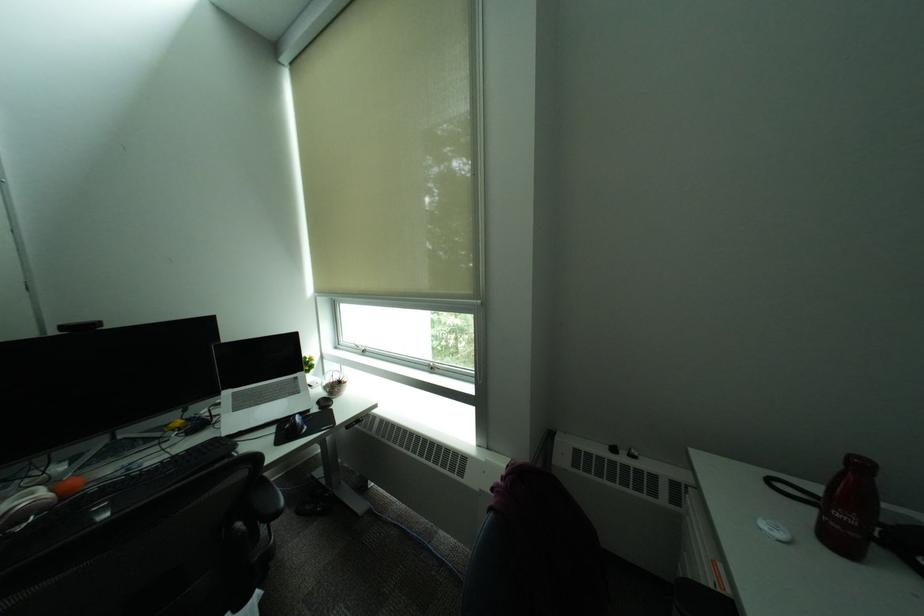
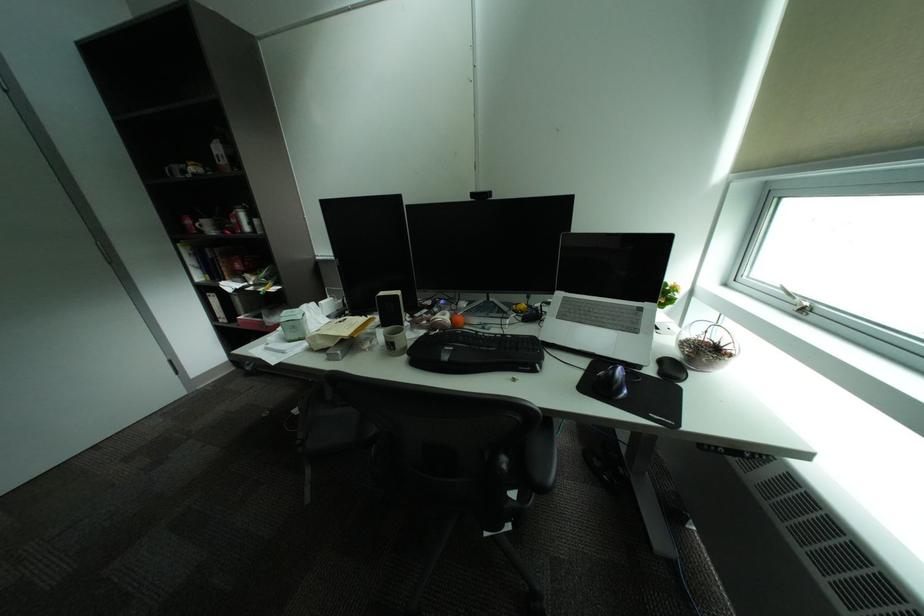
Find the pixel in the second image that matches (x=187, y=456) in the first image.

(516, 336)